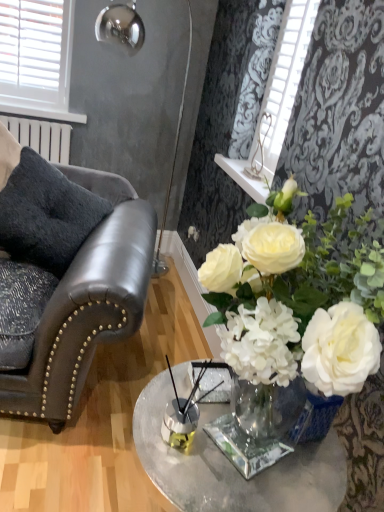
Question: Can you confirm if dark gray plush pillow at left is bigger than clear glass table at center?

Choices:
 (A) no
 (B) yes

Answer: (A)

Question: Considering the relative sizes of dark gray plush pillow at left and clear glass table at center in the image provided, is dark gray plush pillow at left thinner than clear glass table at center?

Choices:
 (A) no
 (B) yes

Answer: (B)

Question: Is dark gray plush pillow at left further to the viewer compared to clear glass table at center?

Choices:
 (A) no
 (B) yes

Answer: (B)

Question: Does dark gray plush pillow at left turn towards clear glass table at center?

Choices:
 (A) no
 (B) yes

Answer: (A)

Question: Is dark gray plush pillow at left touching clear glass table at center?

Choices:
 (A) yes
 (B) no

Answer: (B)

Question: Would you say clear glass table at center is part of dark gray plush pillow at left's contents?

Choices:
 (A) yes
 (B) no

Answer: (B)

Question: Can you confirm if metallic silver lamp at upper left is shorter than white plastic blinds at upper left?

Choices:
 (A) yes
 (B) no

Answer: (B)

Question: Is the position of metallic silver lamp at upper left less distant than that of white plastic blinds at upper left?

Choices:
 (A) yes
 (B) no

Answer: (A)

Question: Is metallic silver lamp at upper left to the right of white plastic blinds at upper left from the viewer's perspective?

Choices:
 (A) no
 (B) yes

Answer: (B)

Question: From the image's perspective, is metallic silver lamp at upper left beneath white plastic blinds at upper left?

Choices:
 (A) no
 (B) yes

Answer: (B)

Question: Is metallic silver lamp at upper left outside white plastic blinds at upper left?

Choices:
 (A) no
 (B) yes

Answer: (B)

Question: From a real-world perspective, is metallic silver lamp at upper left positioned over white plastic blinds at upper left based on gravity?

Choices:
 (A) no
 (B) yes

Answer: (A)

Question: Could you tell me if dark gray plush pillow at left is turned towards black leather chair at left?

Choices:
 (A) no
 (B) yes

Answer: (B)